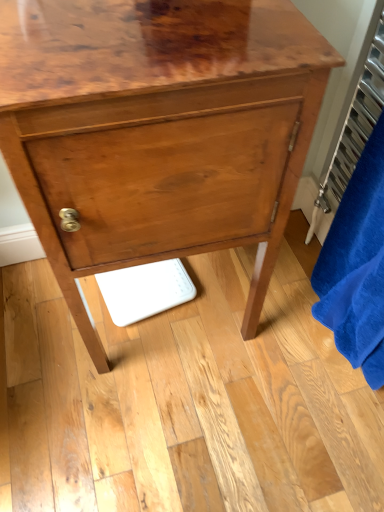
Identify the location of free space in front of blue plush bath towel at right. The width and height of the screenshot is (384, 512). (320, 418).